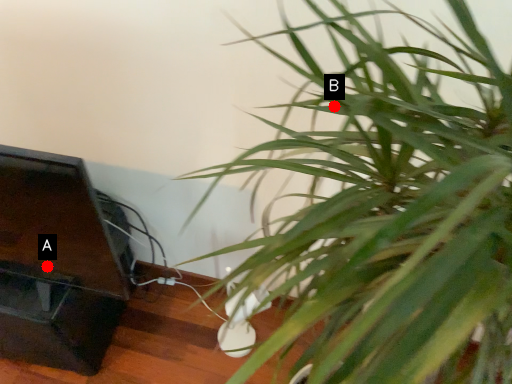
Question: Two points are circled on the image, labeled by A and B beside each circle. Which point is farther to the camera?

Choices:
 (A) A is further
 (B) B is further

Answer: (A)